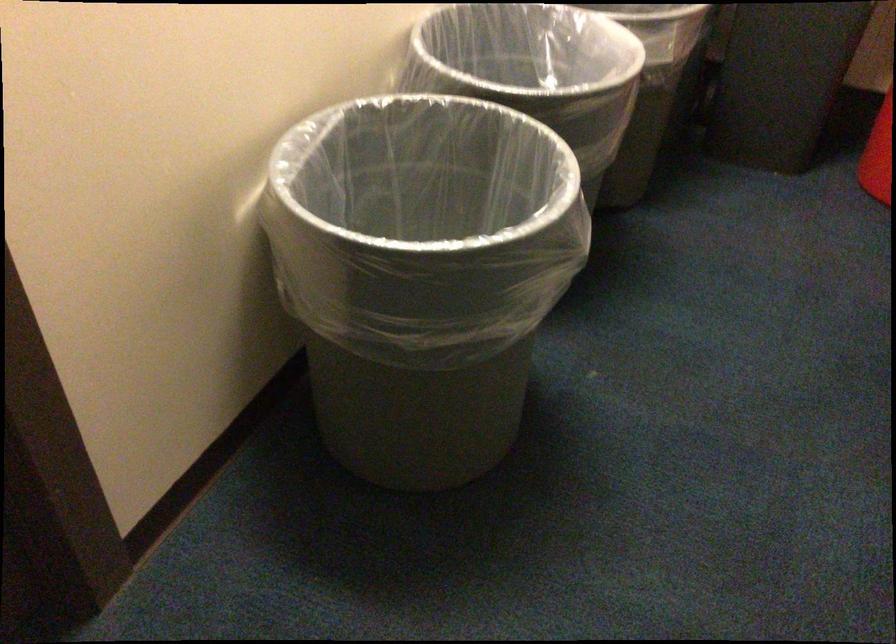
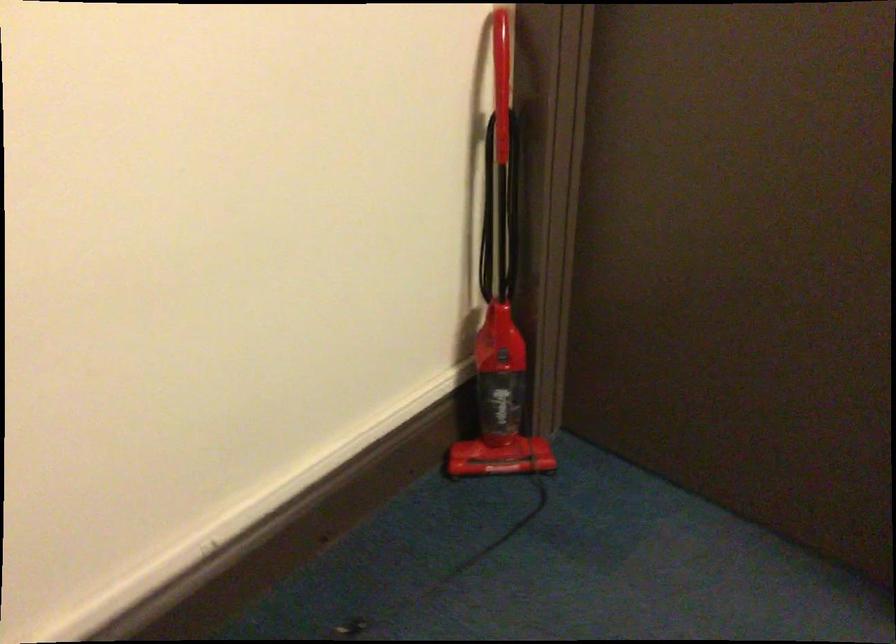
The images are taken continuously from a first-person perspective. In which direction is your viewpoint rotating?

The camera rotated toward left-down.